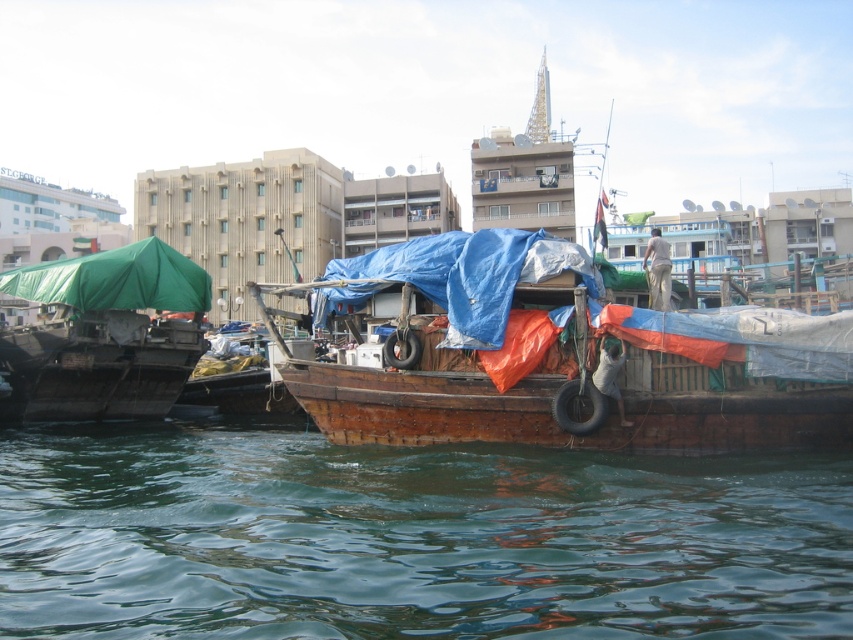
Can you confirm if wooden boat at center is positioned to the left of green tarpaulin canopy at left?

No, wooden boat at center is not to the left of green tarpaulin canopy at left.

Find the location of `wooden boat at center`. wooden boat at center is located at coordinates (573, 362).

The image size is (853, 640). I want to click on wooden boat at center, so click(x=573, y=362).

Where is `wooden boat at center`? This screenshot has height=640, width=853. wooden boat at center is located at coordinates (573, 362).

Which is above, green water at lower center or green tarpaulin canopy at left?

green tarpaulin canopy at left is above.

Which is behind, point (137, 608) or point (105, 252)?

The point (105, 252) is behind.

Identify the location of green water at lower center. The height and width of the screenshot is (640, 853). (410, 538).

Who is positioned more to the left, green water at lower center or green tarpaulin boat at left?

green tarpaulin boat at left

Where is `green water at lower center`? The image size is (853, 640). green water at lower center is located at coordinates (410, 538).